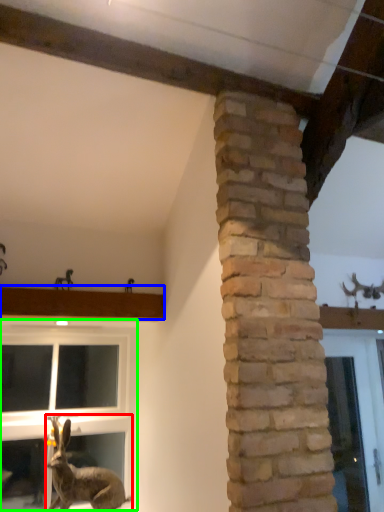
Question: Estimate the real-world distances between objects in this image. Which object is farther from rabbit (highlighted by a red box), window sill (highlighted by a blue box) or window (highlighted by a green box)?

Choices:
 (A) window sill
 (B) window

Answer: (A)